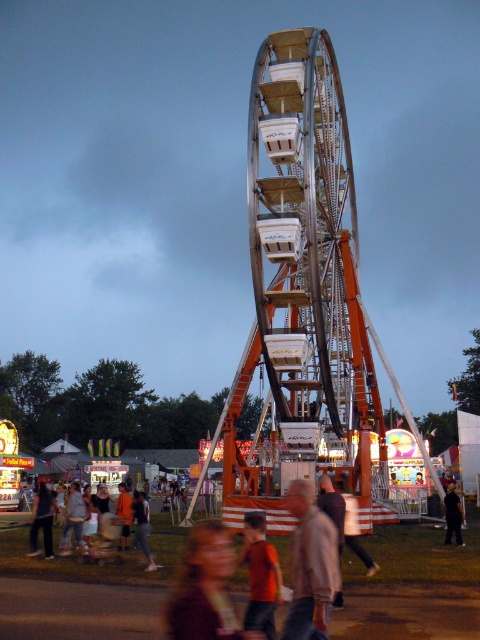
Question: Which object is positioned closest to the dark gray hoodie at center?

Choices:
 (A) light brown jacket at center
 (B) dark brown leather pants at lower center

Answer: (B)

Question: Can you confirm if dark brown leather pants at lower center is positioned above dark brown leather jacket at center?

Choices:
 (A) yes
 (B) no

Answer: (A)

Question: Which object appears farthest from the camera in this image?

Choices:
 (A) orange t-shirt at center
 (B) dark brown leather jacket at lower left
 (C) blurred brown hair at lower center

Answer: (B)

Question: Can you confirm if metallic silver ferris wheel at center is positioned above light brown jacket at center?

Choices:
 (A) no
 (B) yes

Answer: (B)

Question: Which point is farther to the camera?

Choices:
 (A) orange t-shirt at center
 (B) dark brown leather jacket at center

Answer: (B)

Question: Is metallic silver ferris wheel at center thinner than dark brown leather pants at lower center?

Choices:
 (A) no
 (B) yes

Answer: (A)